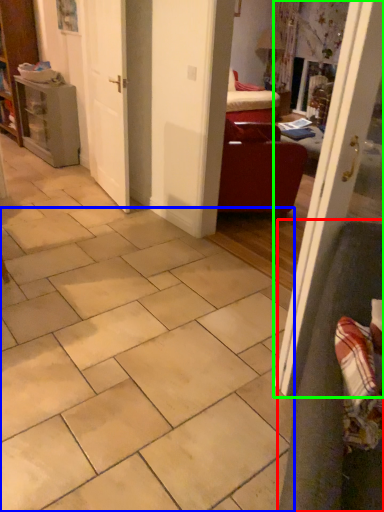
Question: Considering the real-world distances, which object is closest to armchair (highlighted by a red box)? ceramic tile (highlighted by a blue box) or door (highlighted by a green box).

Choices:
 (A) ceramic tile
 (B) door

Answer: (B)